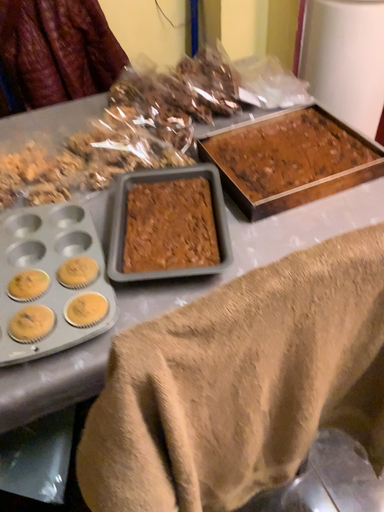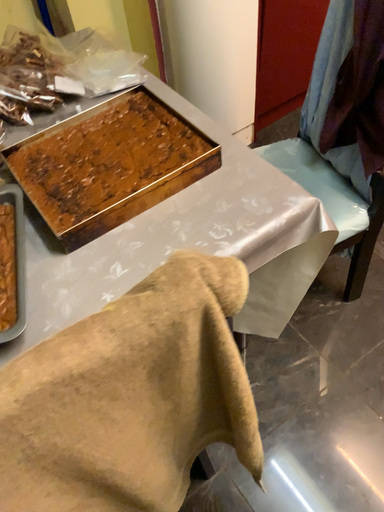
Question: How did the camera likely rotate when shooting the video?

Choices:
 (A) rotated right
 (B) rotated left

Answer: (A)